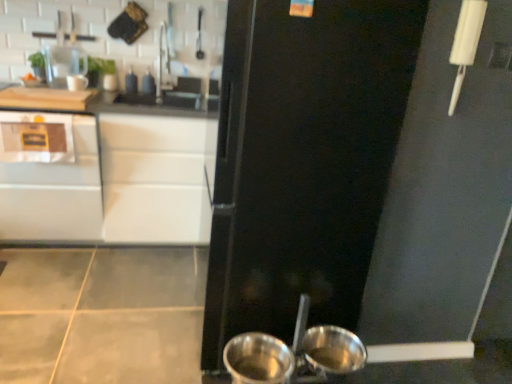
Question: Does shiny metallic pot at lower center lie in front of satin white cabinet at left?

Choices:
 (A) yes
 (B) no

Answer: (A)

Question: Does shiny metallic pot at lower center touch satin white cabinet at left?

Choices:
 (A) no
 (B) yes

Answer: (A)

Question: Is shiny metallic pot at lower center far from satin white cabinet at left?

Choices:
 (A) no
 (B) yes

Answer: (B)

Question: Can satin white cabinet at left be found inside shiny metallic pot at lower center?

Choices:
 (A) no
 (B) yes

Answer: (A)

Question: From a real-world perspective, does shiny metallic pot at lower center sit lower than satin white cabinet at left?

Choices:
 (A) no
 (B) yes

Answer: (B)

Question: Considering their positions, is brushed metal faucet at upper center located in front of or behind white glossy cabinet at upper left?

Choices:
 (A) front
 (B) behind

Answer: (B)

Question: Considering the positions of point (169, 82) and point (37, 221), is point (169, 82) closer or farther from the camera than point (37, 221)?

Choices:
 (A) farther
 (B) closer

Answer: (A)

Question: In the image, is brushed metal faucet at upper center on the left side or the right side of white glossy cabinet at upper left?

Choices:
 (A) left
 (B) right

Answer: (B)

Question: Is brushed metal faucet at upper center inside the boundaries of white glossy cabinet at upper left, or outside?

Choices:
 (A) inside
 (B) outside

Answer: (B)

Question: Looking at the image, does brushed metal faucet at upper center seem bigger or smaller compared to satin white cabinet at left?

Choices:
 (A) small
 (B) big

Answer: (A)

Question: Is brushed metal faucet at upper center inside the boundaries of satin white cabinet at left, or outside?

Choices:
 (A) inside
 (B) outside

Answer: (B)

Question: In terms of width, does brushed metal faucet at upper center look wider or thinner when compared to satin white cabinet at left?

Choices:
 (A) thin
 (B) wide

Answer: (A)

Question: From a real-world perspective, is brushed metal faucet at upper center positioned above or below satin white cabinet at left?

Choices:
 (A) below
 (B) above

Answer: (B)

Question: Considering the positions of point [253, 332] and point [161, 82], is point [253, 332] closer or farther from the camera than point [161, 82]?

Choices:
 (A) closer
 (B) farther

Answer: (A)

Question: Is shiny metallic pot at lower center wider or thinner than brushed metal faucet at upper center?

Choices:
 (A) thin
 (B) wide

Answer: (B)